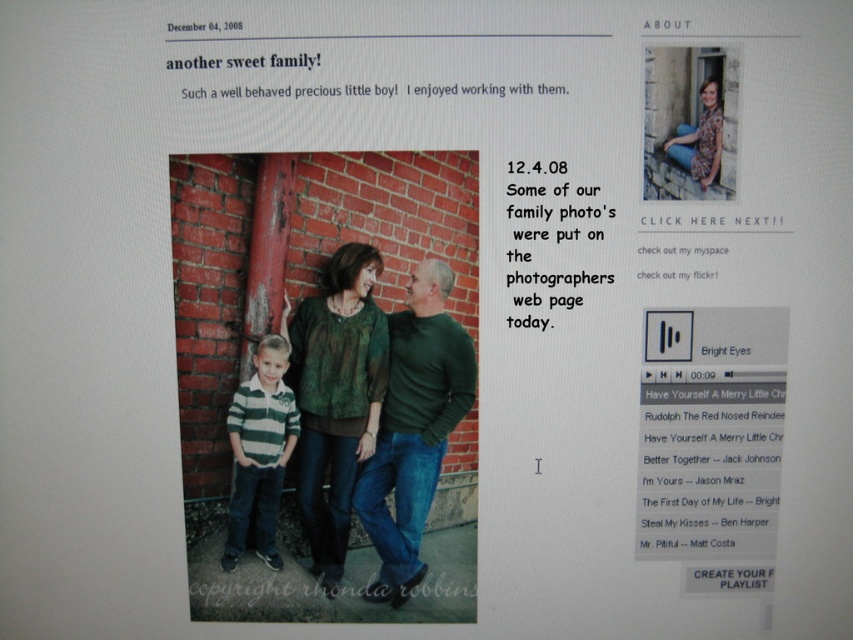
Can you confirm if green sweater at center is smaller than green striped polo shirt at lower left?

No, green sweater at center is not smaller than green striped polo shirt at lower left.

Which is more to the right, green sweater at center or green striped polo shirt at lower left?

From the viewer's perspective, green sweater at center appears more on the right side.

This screenshot has width=853, height=640. Find the location of `green sweater at center`. green sweater at center is located at coordinates (415, 428).

This screenshot has width=853, height=640. What are the coordinates of `green sweater at center` in the screenshot? It's located at (415, 428).

Can you confirm if green textured blouse at center is positioned below green striped polo shirt at lower left?

Incorrect, green textured blouse at center is not positioned below green striped polo shirt at lower left.

Is the position of green textured blouse at center less distant than that of green striped polo shirt at lower left?

Yes, green textured blouse at center is in front of green striped polo shirt at lower left.

Measure the distance between green textured blouse at center and camera.

A distance of 3.59 feet exists between green textured blouse at center and camera.

You are a GUI agent. You are given a task and a screenshot of the screen. Output one action in this format:
    pyautogui.click(x=<x>, y=<y>)
    Task: Click on the green textured blouse at center
    The image size is (853, 640).
    Given the screenshot: What is the action you would take?
    pyautogui.click(x=335, y=396)

Does green striped polo shirt at lower left have a larger size compared to floral shirt at upper right?

Correct, green striped polo shirt at lower left is larger in size than floral shirt at upper right.

Which is in front, point (242, 538) or point (698, 161)?

Point (698, 161)

This screenshot has width=853, height=640. Find the location of `green striped polo shirt at lower left`. green striped polo shirt at lower left is located at coordinates (259, 451).